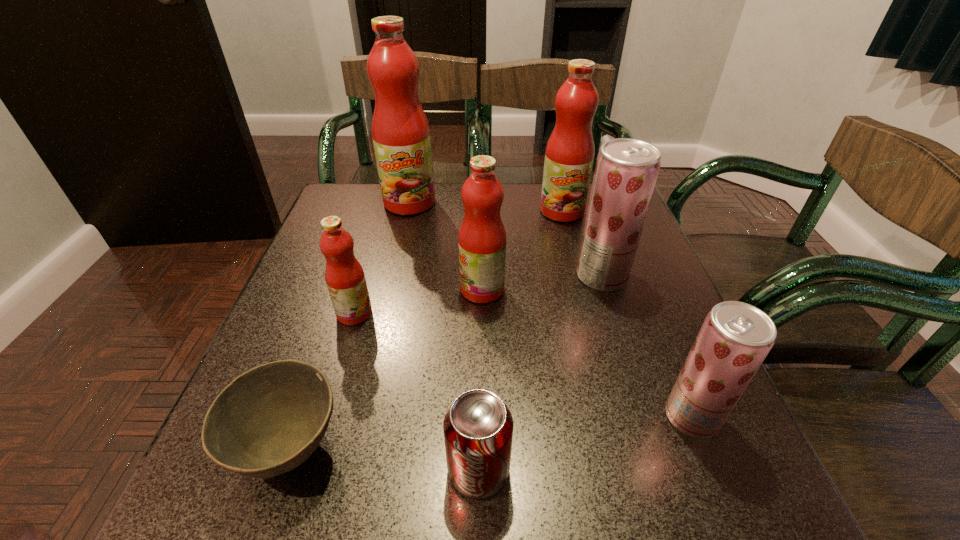
Identify the location of blank area at the right edge. (657, 258).

In the image, there is a desktop. Find the location of `vacant area at the far left corner`. vacant area at the far left corner is located at coordinates (369, 223).

In the image, there is a desktop. Where is `free space at the near right corner`? free space at the near right corner is located at coordinates (661, 473).

At what (x,y) coordinates should I click in order to perform the action: click on unoccupied position between the biggest pink fruit juice and the smallest pink fruit juice. Please return your answer as a coordinate pair (x, y). The image size is (960, 540). Looking at the image, I should click on coord(382,258).

At what (x,y) coordinates should I click in order to perform the action: click on free point between the nearer strawberry fruit juice and the rightmost pink fruit juice. Please return your answer as a coordinate pair (x, y). This screenshot has width=960, height=540. Looking at the image, I should click on (627, 314).

Where is `free space between the biggest pink fruit juice and the third pink fruit juice from left to right`? free space between the biggest pink fruit juice and the third pink fruit juice from left to right is located at coordinates (445, 246).

Where is `free space between the third biggest pink fruit juice and the soda can`? The height and width of the screenshot is (540, 960). free space between the third biggest pink fruit juice and the soda can is located at coordinates (480, 380).

The height and width of the screenshot is (540, 960). I want to click on vacant area that lies between the soda can and the third fruit juice from left to right, so click(480, 380).

Identify the location of object that is the third closest to the shortest object. The height and width of the screenshot is (540, 960). (482, 239).

The height and width of the screenshot is (540, 960). Find the location of `object that ranks as the third closest to the smaller strawberry fruit juice`. object that ranks as the third closest to the smaller strawberry fruit juice is located at coordinates (482, 239).